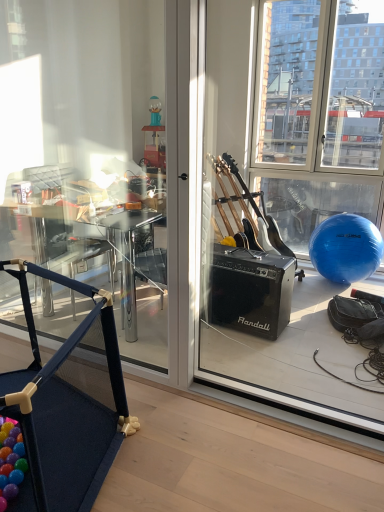
Question: Could wooden floor at lower left be considered to be inside blue fabric playpen at lower left?

Choices:
 (A) yes
 (B) no

Answer: (B)

Question: Is blue fabric playpen at lower left next to wooden floor at lower left and touching it?

Choices:
 (A) yes
 (B) no

Answer: (B)

Question: Can you confirm if blue fabric playpen at lower left is taller than wooden floor at lower left?

Choices:
 (A) yes
 (B) no

Answer: (A)

Question: From the image's perspective, does blue fabric playpen at lower left appear lower than wooden floor at lower left?

Choices:
 (A) yes
 (B) no

Answer: (B)

Question: Can we say blue fabric playpen at lower left lies outside wooden floor at lower left?

Choices:
 (A) yes
 (B) no

Answer: (A)

Question: From the image's perspective, does blue fabric playpen at lower left appear higher than wooden floor at lower left?

Choices:
 (A) no
 (B) yes

Answer: (B)

Question: Considering the relative sizes of wooden floor at lower left and blue fabric playpen at lower left in the image provided, is wooden floor at lower left thinner than blue fabric playpen at lower left?

Choices:
 (A) no
 (B) yes

Answer: (A)

Question: From the image's perspective, is wooden floor at lower left under blue fabric playpen at lower left?

Choices:
 (A) no
 (B) yes

Answer: (B)

Question: Does wooden floor at lower left have a greater width compared to blue fabric playpen at lower left?

Choices:
 (A) yes
 (B) no

Answer: (A)

Question: Can you confirm if wooden floor at lower left is positioned to the right of blue fabric playpen at lower left?

Choices:
 (A) no
 (B) yes

Answer: (B)

Question: Is the depth of wooden floor at lower left less than that of blue fabric playpen at lower left?

Choices:
 (A) no
 (B) yes

Answer: (A)

Question: From a real-world perspective, is wooden floor at lower left on top of blue fabric playpen at lower left?

Choices:
 (A) no
 (B) yes

Answer: (A)

Question: Does transparent glass window screen at right have a greater height compared to blue fabric playpen at lower left?

Choices:
 (A) no
 (B) yes

Answer: (B)